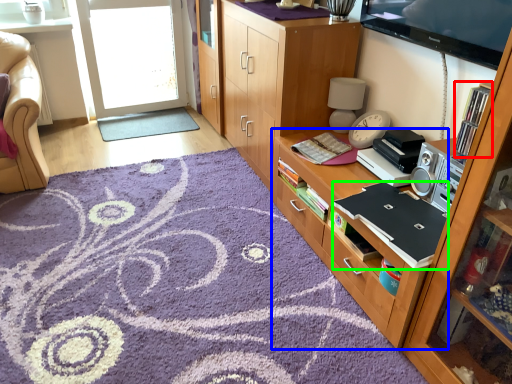
Question: Considering the real-world distances, which object is closest to shelf (highlighted by a red box)? cabinetry (highlighted by a blue box) or laptop (highlighted by a green box).

Choices:
 (A) cabinetry
 (B) laptop

Answer: (B)